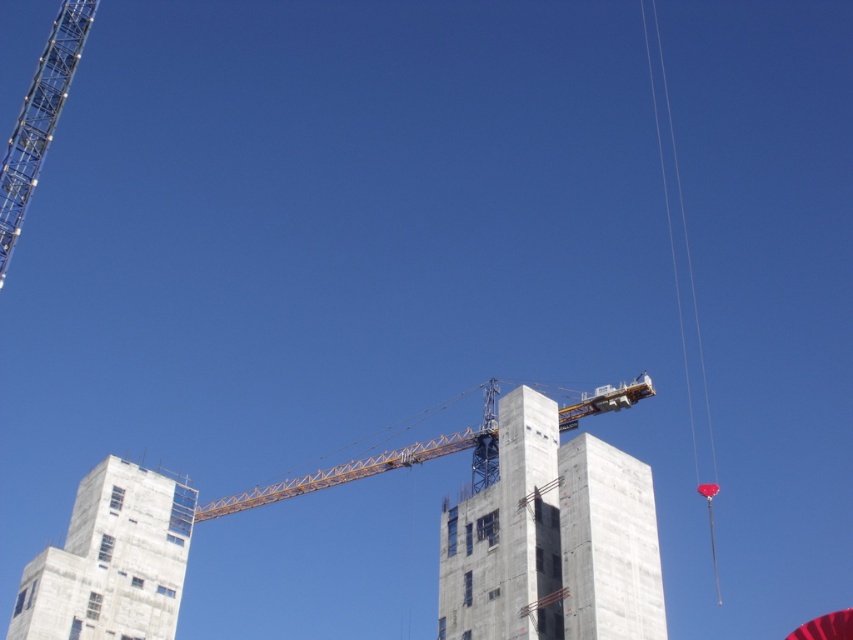
Does concrete at center appear on the right side of yellow metallic crane at center?

Indeed, concrete at center is positioned on the right side of yellow metallic crane at center.

Does point (579, 518) come farther from viewer compared to point (408, 464)?

No.

Find the location of a particular element. concrete at center is located at coordinates (552, 540).

Can you confirm if concrete building at lower left is positioned below yellow metallic crane at center?

Yes, concrete building at lower left is below yellow metallic crane at center.

Who is positioned more to the right, concrete building at lower left or yellow metallic crane at center?

yellow metallic crane at center is more to the right.

Between point (96, 618) and point (387, 465), which one is positioned in front?

Point (96, 618) is in front.

Find the location of a particular element. concrete building at lower left is located at coordinates 111,561.

Find the location of a particular element. Image resolution: width=853 pixels, height=640 pixels. concrete at center is located at coordinates pyautogui.click(x=552, y=540).

This screenshot has height=640, width=853. What are the coordinates of `concrete at center` in the screenshot? It's located at (552, 540).